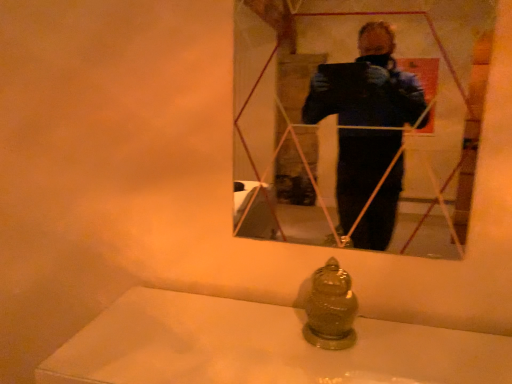
Question: Is the depth of matte ceramic bath at lower center less than that of matte glass mirror at upper center?

Choices:
 (A) yes
 (B) no

Answer: (A)

Question: Is matte ceramic bath at lower center not within matte glass mirror at upper center?

Choices:
 (A) yes
 (B) no

Answer: (A)

Question: Could you tell me if matte ceramic bath at lower center is facing matte glass mirror at upper center?

Choices:
 (A) yes
 (B) no

Answer: (B)

Question: From a real-world perspective, is matte ceramic bath at lower center physically above matte glass mirror at upper center?

Choices:
 (A) no
 (B) yes

Answer: (A)

Question: Is matte ceramic bath at lower center looking in the opposite direction of matte glass mirror at upper center?

Choices:
 (A) no
 (B) yes

Answer: (A)

Question: Is matte ceramic bath at lower center not near matte glass mirror at upper center?

Choices:
 (A) no
 (B) yes

Answer: (B)

Question: Is matte glass mirror at upper center smaller than matte ceramic bath at lower center?

Choices:
 (A) yes
 (B) no

Answer: (A)

Question: Can you confirm if matte glass mirror at upper center is positioned to the left of matte ceramic bath at lower center?

Choices:
 (A) yes
 (B) no

Answer: (B)

Question: Is matte glass mirror at upper center not close to matte ceramic bath at lower center?

Choices:
 (A) yes
 (B) no

Answer: (A)

Question: Is matte glass mirror at upper center surrounding matte ceramic bath at lower center?

Choices:
 (A) no
 (B) yes

Answer: (A)

Question: Is matte glass mirror at upper center at the right side of matte ceramic bath at lower center?

Choices:
 (A) no
 (B) yes

Answer: (B)

Question: Is matte glass mirror at upper center positioned behind matte ceramic bath at lower center?

Choices:
 (A) yes
 (B) no

Answer: (A)

Question: From a real-world perspective, relative to matte glass mirror at upper center, is matte ceramic bath at lower center vertically above or below?

Choices:
 (A) below
 (B) above

Answer: (A)